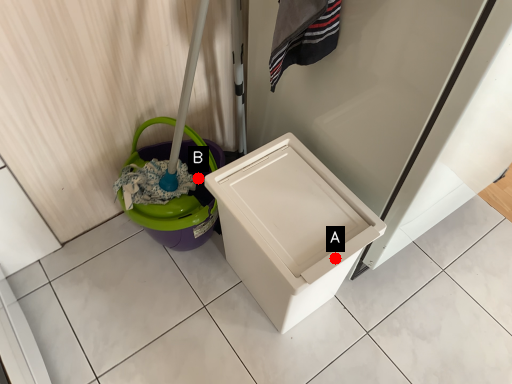
Question: Two points are circled on the image, labeled by A and B beside each circle. Which point appears closest to the camera in this image?

Choices:
 (A) A is closer
 (B) B is closer

Answer: (A)